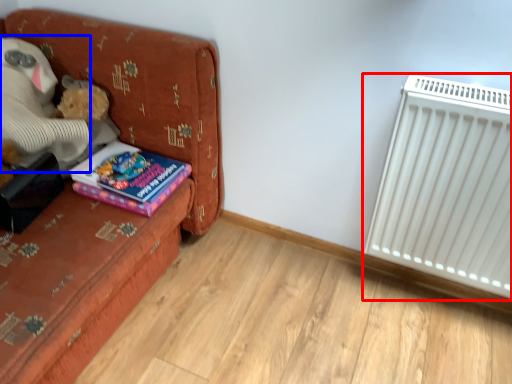
Question: Which point is closer to the camera, radiator (highlighted by a red box) or teddy (highlighted by a blue box)?

Choices:
 (A) radiator
 (B) teddy

Answer: (A)